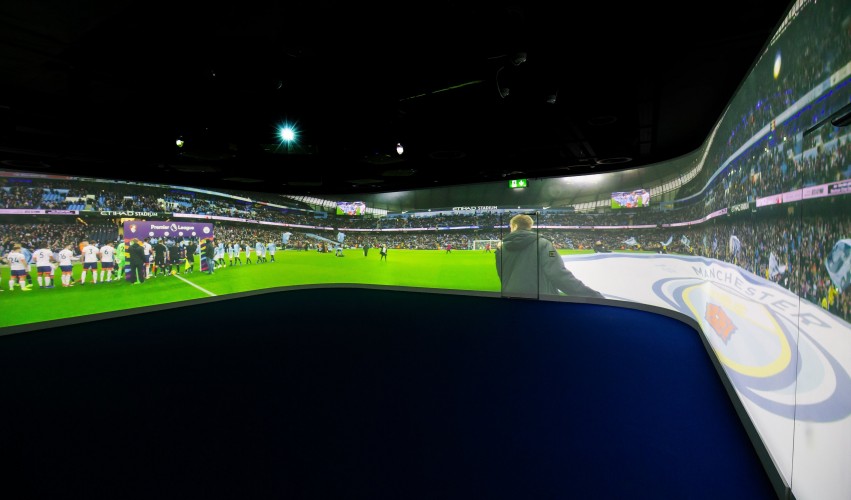
You are a GUI agent. You are given a task and a screenshot of the screen. Output one action in this format:
    pyautogui.click(x=<x>, y=<y>)
    Task: Click on the lamps
    
    Given the screenshot: What is the action you would take?
    pyautogui.click(x=180, y=140), pyautogui.click(x=288, y=131), pyautogui.click(x=400, y=152)